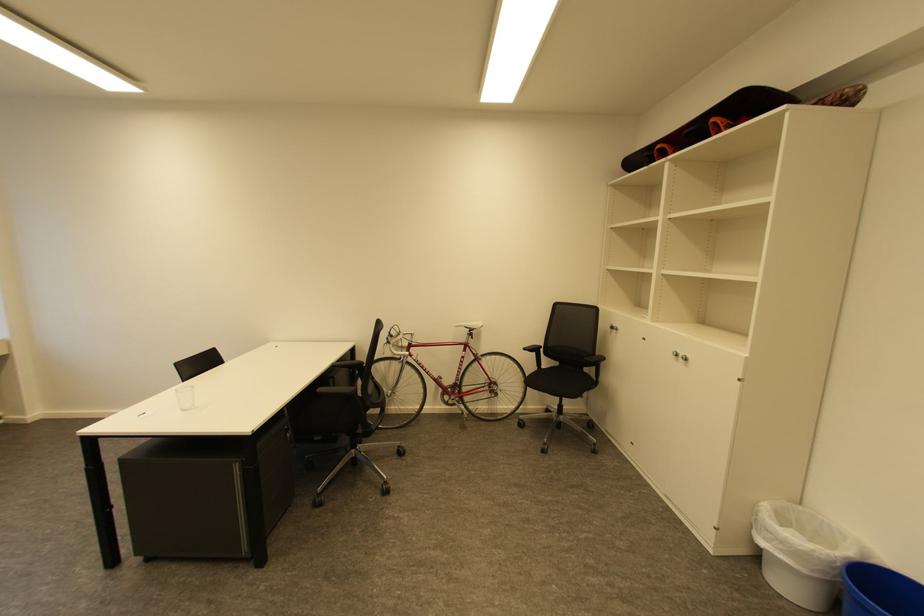
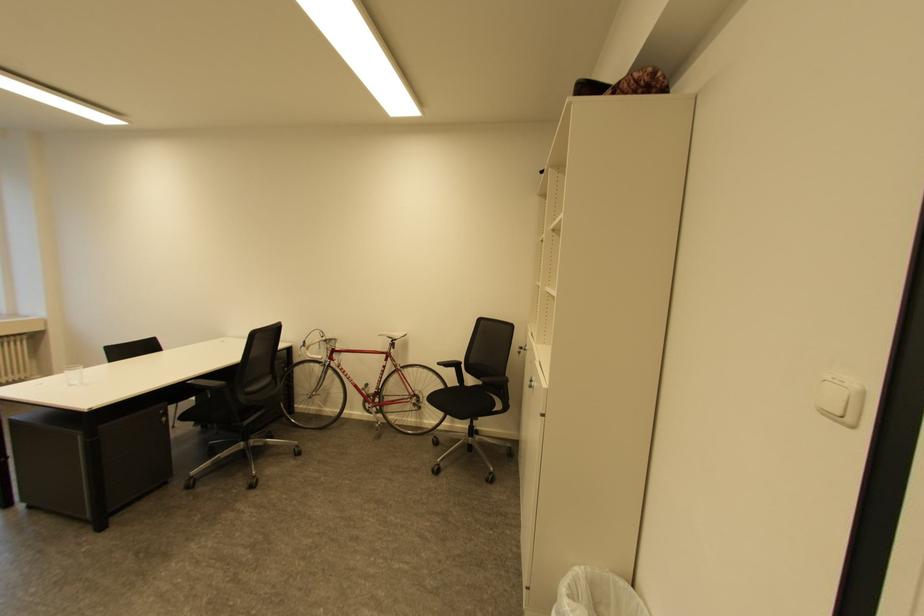
Question: The images are taken continuously from a first-person perspective. In which direction are you moving?

Choices:
 (A) Left
 (B) Right
 (C) Forward
 (D) Backward

Answer: (B)